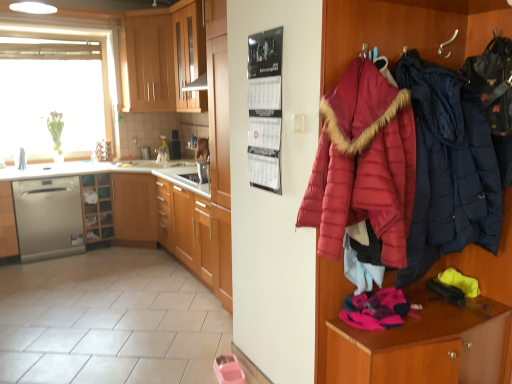
Question: Is wooden cabinet at upper center, the second cabinetry when ordered from left to right, inside or outside of wooden shelves at lower left?

Choices:
 (A) inside
 (B) outside

Answer: (B)

Question: From the image's perspective, is wooden cabinet at upper center, the second cabinetry when ordered from left to right, above or below wooden shelves at lower left?

Choices:
 (A) below
 (B) above

Answer: (B)

Question: Based on their relative distances, which object is nearer to the satin silver dishwasher at left, acting as the 1th cabinetry starting from the left?

Choices:
 (A) wooden cabinet at upper center, acting as the 2th cabinetry starting from the right
 (B) satin silver dishwasher at lower left
 (C) white glossy sink at center
 (D) green leafy plant at upper left
 (E) dark blue quilted jacket at right, which is the second jacket in left-to-right order

Answer: (B)

Question: Which object is positioned closest to the wooden cabinet at upper center, the 3th cabinetry in the left-to-right sequence?

Choices:
 (A) wooden shelves at lower left
 (B) matte wood dresser at right
 (C) green leafy plant at upper left
 (D) white glossy sink at center
 (E) satin silver dishwasher at left, acting as the 1th cabinetry starting from the left

Answer: (D)